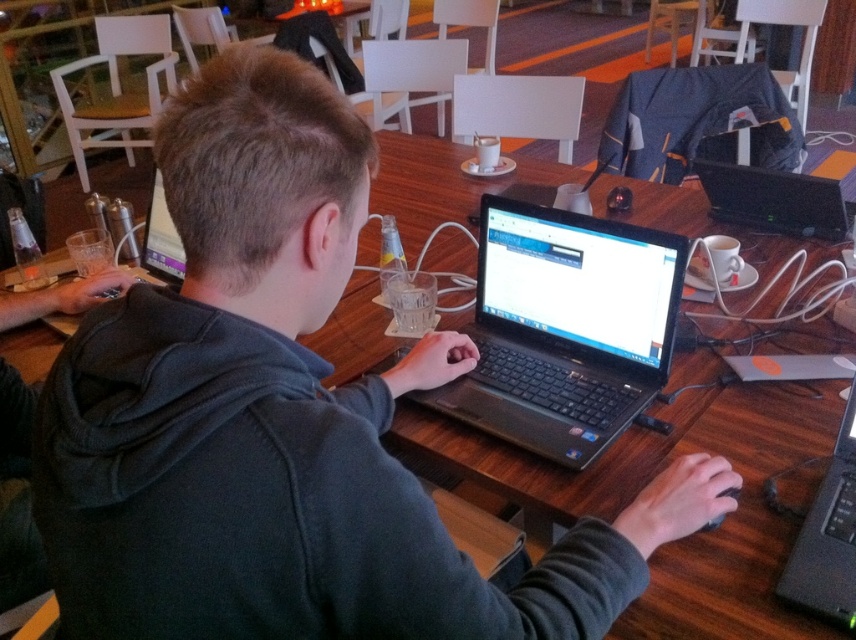
Is black matte laptop at center positioned in front of black plastic laptop at center?

That is False.

Is point (554, 456) behind point (822, 564)?

That is True.

Describe the element at coordinates (565, 328) in the screenshot. I see `black matte laptop at center` at that location.

Where is `black matte laptop at center`? This screenshot has height=640, width=856. black matte laptop at center is located at coordinates (565, 328).

Between black matte laptop at center and black plastic laptop at upper right, which one is positioned lower?

Positioned lower is black matte laptop at center.

Does point (518, 410) lie behind point (780, 184)?

That is False.

At what (x,y) coordinates should I click in order to perform the action: click on black matte laptop at center. Please return your answer as a coordinate pair (x, y). The height and width of the screenshot is (640, 856). Looking at the image, I should click on (565, 328).

Find the location of a particular element. The image size is (856, 640). black matte laptop at center is located at coordinates (565, 328).

Which of these two, black plastic laptop at center or black plastic laptop at upper right, stands shorter?

With less height is black plastic laptop at upper right.

Which is above, black plastic laptop at center or black plastic laptop at upper right?

black plastic laptop at upper right

Find the location of `black plastic laptop at center`. black plastic laptop at center is located at coordinates (828, 536).